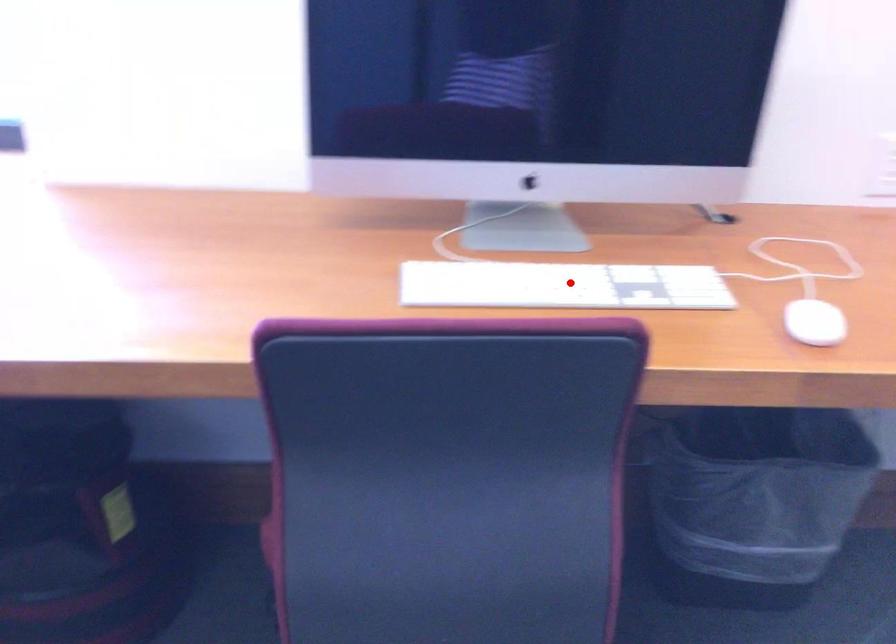
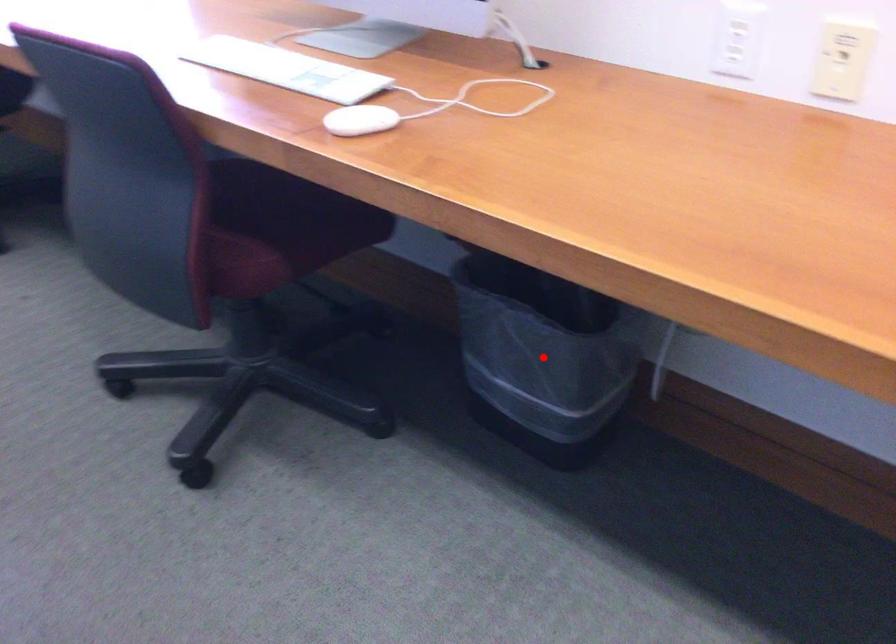
I am providing you with two images of the same scene from different viewpoints. A red point is marked on the first image and another point is marked on the second image. Are the points marked in image1 and image2 representing the same 3D position?

No